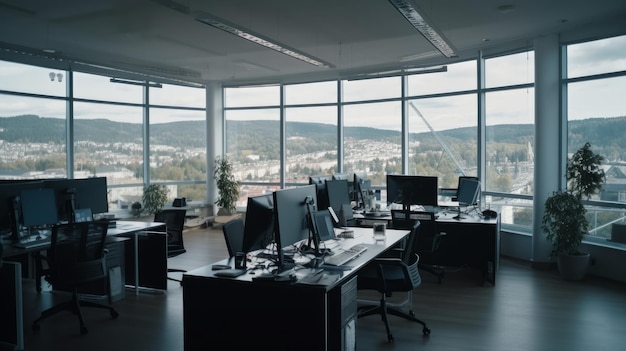
The image size is (626, 351). Identify the location of white ceiling in office. [x=310, y=18], [x=349, y=43], [x=177, y=43], [x=476, y=19].